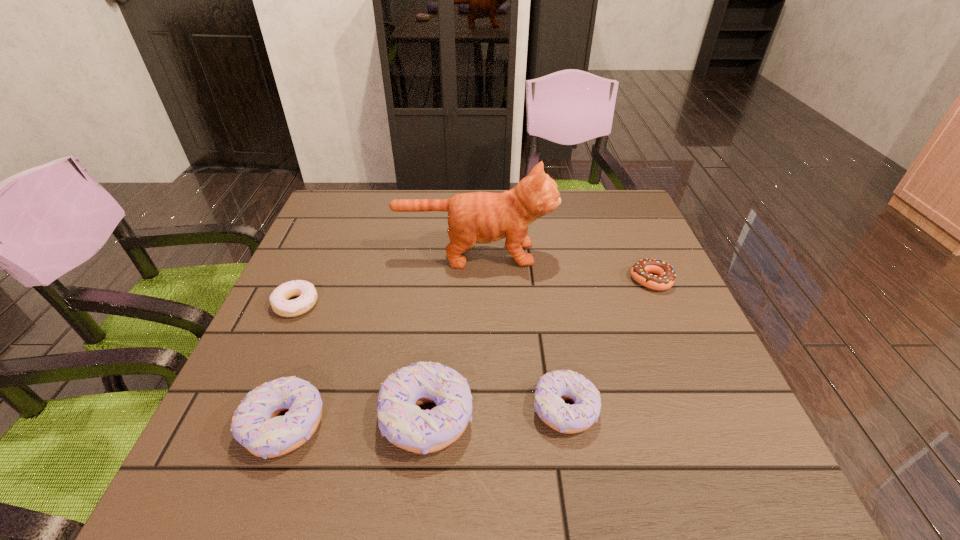
Find the location of a particular element. The width and height of the screenshot is (960, 540). free space between the third doughnut from left to right and the tallest object is located at coordinates (451, 336).

What are the coordinates of `vacant space in between the rightmost object and the third doughnut from left to right` in the screenshot? It's located at (539, 349).

I want to click on empty space between the third tallest object and the tallest object, so click(x=379, y=340).

The height and width of the screenshot is (540, 960). I want to click on vacant area that lies between the third doughnut from left to right and the tallest object, so click(451, 336).

Locate an element on the screen. vacant area that lies between the third doughnut from left to right and the fourth doughnut from left to right is located at coordinates (496, 413).

Where is `vacant point located between the fourth doughnut from left to right and the rightmost object`? The height and width of the screenshot is (540, 960). vacant point located between the fourth doughnut from left to right and the rightmost object is located at coordinates (608, 345).

Locate an element on the screen. This screenshot has width=960, height=540. vacant area that lies between the rightmost doughnut and the third doughnut from left to right is located at coordinates (539, 349).

Image resolution: width=960 pixels, height=540 pixels. What are the coordinates of `vacant area that lies between the third shortest doughnut and the third doughnut from left to right` in the screenshot? It's located at (496, 413).

This screenshot has height=540, width=960. Identify the location of object that stands as the fourth closest to the tallest object. (553, 388).

Identify the location of object identified as the closest to the fourth shortest object. (400, 419).